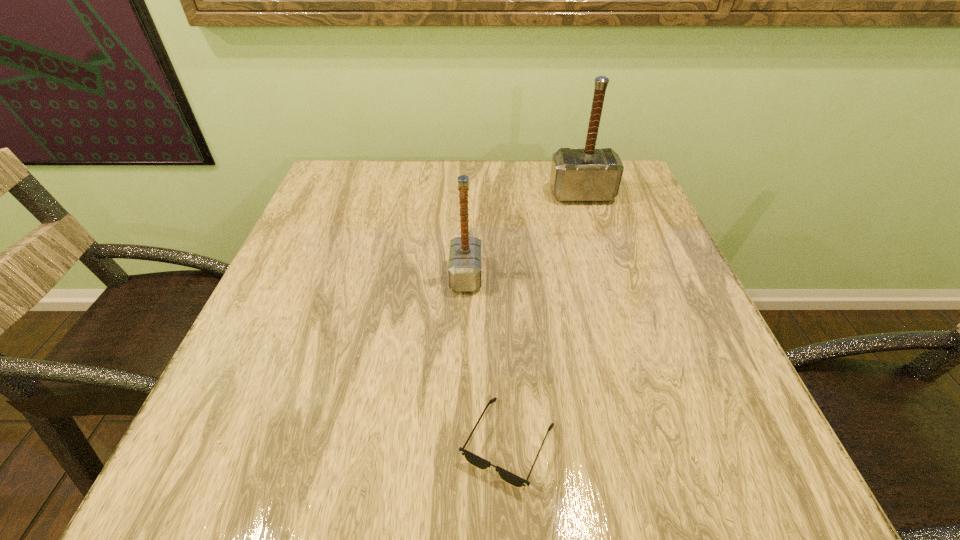
Where is `the tallest object`? The width and height of the screenshot is (960, 540). the tallest object is located at coordinates (577, 175).

The image size is (960, 540). In order to click on the farthest object in this screenshot , I will do `click(577, 175)`.

Find the location of a particular element. the second shortest object is located at coordinates (464, 268).

Locate an element on the screen. This screenshot has height=540, width=960. the left hammer is located at coordinates (464, 268).

I want to click on sunglasses, so click(510, 478).

Identify the location of the nearest object. The image size is (960, 540). (510, 478).

Where is `free spot located 0.080m on the front of the rightmost object`? Image resolution: width=960 pixels, height=540 pixels. free spot located 0.080m on the front of the rightmost object is located at coordinates (591, 225).

At what (x,y) coordinates should I click in order to perform the action: click on free space located on the striking surface of the second tallest object. Please return your answer as a coordinate pair (x, y). Looking at the image, I should click on (654, 275).

This screenshot has height=540, width=960. Identify the location of object at the far edge. (577, 175).

You are a GUI agent. You are given a task and a screenshot of the screen. Output one action in this format:
    pyautogui.click(x=<x>, y=<y>)
    Task: Click on the object at the near edge
    This screenshot has height=540, width=960.
    Given the screenshot: What is the action you would take?
    pyautogui.click(x=510, y=478)